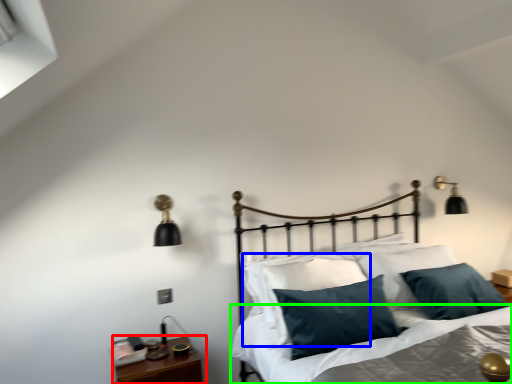
Question: Which object is positioned farthest from nightstand (highlighted by a red box)? Select from pillow (highlighted by a blue box) and sheet (highlighted by a green box).

Choices:
 (A) pillow
 (B) sheet

Answer: (A)